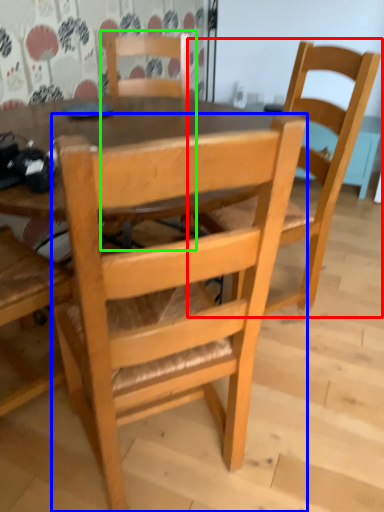
Question: Estimate the real-world distances between objects in this image. Which object is farther from chair (highlighted by a red box), chair (highlighted by a blue box) or chair (highlighted by a green box)?

Choices:
 (A) chair
 (B) chair

Answer: (B)